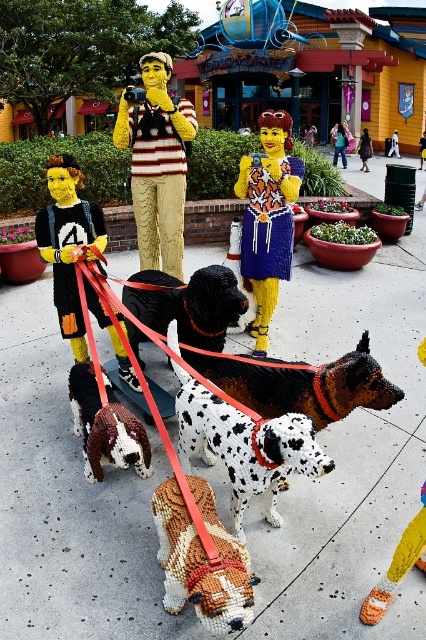
You are a tour guide leading a group of visitors through the LEGO display. You notice two LEGO figures in the center of the scene. One has brown and white speckled dog at center and the other has matte yellow hair at center. If you want to move between them, will you have enough space to walk comfortably? Please consider the average walking space required for a person.

The distance between the brown and white speckled dog at center and the matte yellow hair at center is 56.90 feet. Since the average comfortable walking space between two points for a person is around 3 to 5 feet, there is more than enough space to move comfortably between them.

You are a LEGO enthusiast trying to assemble a display. You have a brown speckled fur dog at center and a smooth plastic figure at center. Which one should you place on the lower shelf if you want the taller object to be visible above the shorter one?

The smooth plastic figure at center is taller than the brown speckled fur dog at center. To ensure visibility, place the shorter brown speckled fur dog at center on the lower shelf so the taller smooth plastic figure at center can be seen above it.